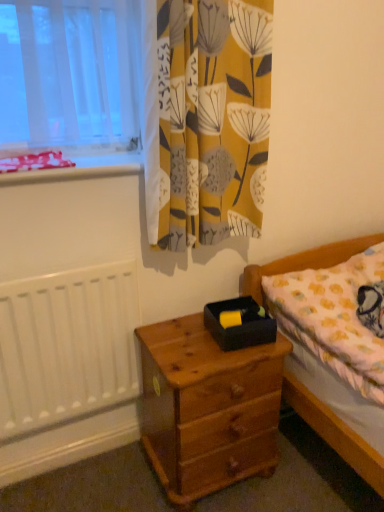
This screenshot has height=512, width=384. I want to click on free spot to the left of black matte box at center, so click(x=176, y=342).